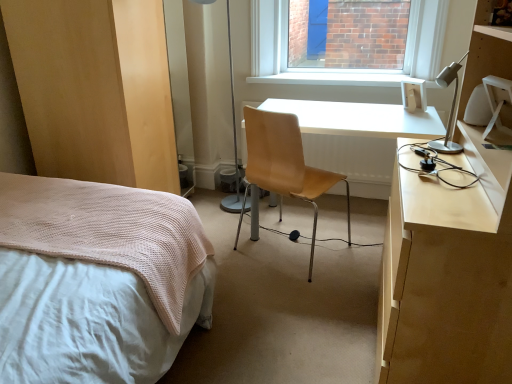
Question: Is white smooth window sill at upper center next to light brown wood dresser at lower left?

Choices:
 (A) no
 (B) yes

Answer: (A)

Question: Is white smooth window sill at upper center at the left side of light brown wood dresser at lower left?

Choices:
 (A) yes
 (B) no

Answer: (B)

Question: Is white smooth window sill at upper center in front of light brown wood dresser at lower left?

Choices:
 (A) yes
 (B) no

Answer: (B)

Question: From the image's perspective, is white smooth window sill at upper center above light brown wood dresser at lower left?

Choices:
 (A) no
 (B) yes

Answer: (B)

Question: Can you confirm if white smooth window sill at upper center is taller than light brown wood dresser at lower left?

Choices:
 (A) no
 (B) yes

Answer: (A)

Question: From their relative heights in the image, would you say metallic silver table lamp at center is taller or shorter than light brown wood dresser at lower left?

Choices:
 (A) short
 (B) tall

Answer: (A)

Question: From the image's perspective, is metallic silver table lamp at center positioned above or below light brown wood dresser at lower left?

Choices:
 (A) above
 (B) below

Answer: (B)

Question: From a real-world perspective, relative to light brown wood dresser at lower left, is metallic silver table lamp at center vertically above or below?

Choices:
 (A) above
 (B) below

Answer: (B)

Question: In terms of width, does metallic silver table lamp at center look wider or thinner when compared to light brown wood dresser at lower left?

Choices:
 (A) wide
 (B) thin

Answer: (B)

Question: From the image's perspective, relative to silver metallic desk lamp at upper right, is metallic silver table lamp at center above or below?

Choices:
 (A) below
 (B) above

Answer: (B)

Question: Is point (193, 134) positioned closer to the camera than point (444, 84)?

Choices:
 (A) closer
 (B) farther

Answer: (B)

Question: From a real-world perspective, is metallic silver table lamp at center above or below silver metallic desk lamp at upper right?

Choices:
 (A) above
 (B) below

Answer: (B)

Question: Is metallic silver table lamp at center in front of or behind silver metallic desk lamp at upper right in the image?

Choices:
 (A) behind
 (B) front

Answer: (A)

Question: Looking at the image, does silver metallic desk lamp at upper right seem bigger or smaller compared to white smooth window sill at upper center?

Choices:
 (A) small
 (B) big

Answer: (A)

Question: Is silver metallic desk lamp at upper right wider or thinner than white smooth window sill at upper center?

Choices:
 (A) thin
 (B) wide

Answer: (A)